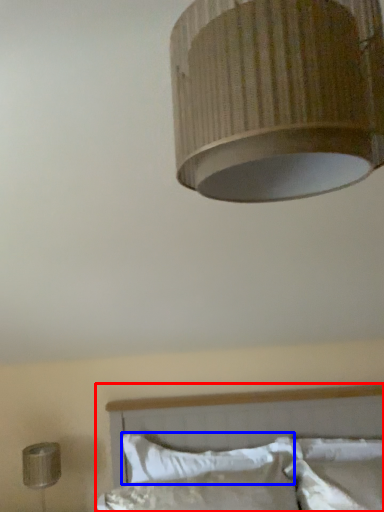
Question: Among these objects, which one is farthest to the camera, bed (highlighted by a red box) or pillow (highlighted by a blue box)?

Choices:
 (A) bed
 (B) pillow

Answer: (B)